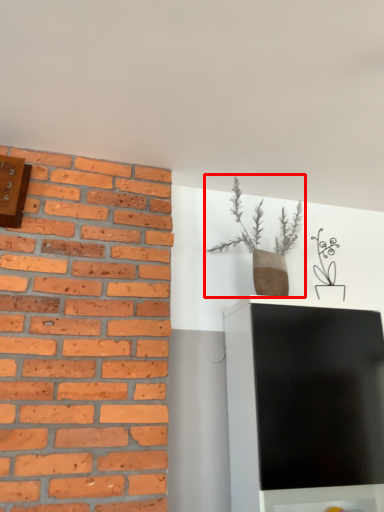
Question: From the image's perspective, considering the relative positions of houseplant (annotated by the red box) and clock in the image provided, where is houseplant (annotated by the red box) located with respect to the staircase?

Choices:
 (A) above
 (B) below

Answer: (B)